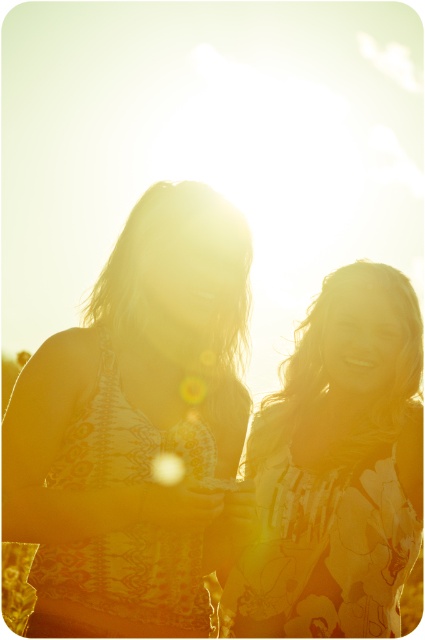
Is the position of matte yellow dress at left more distant than that of floral-patterned dress at right?

No, matte yellow dress at left is in front of floral-patterned dress at right.

Which is more to the left, matte yellow dress at left or floral-patterned dress at right?

Positioned to the left is matte yellow dress at left.

Is point (36, 371) less distant than point (289, 499)?

Yes.

This screenshot has height=640, width=425. In order to click on matte yellow dress at left in this screenshot , I will do `click(136, 428)`.